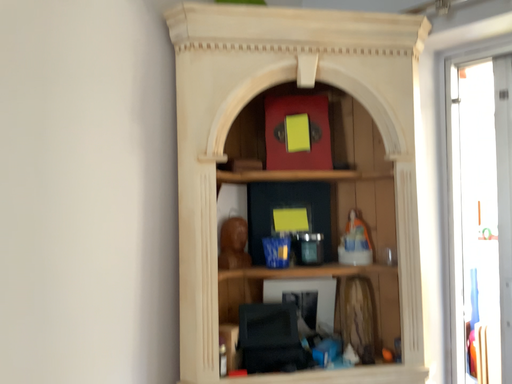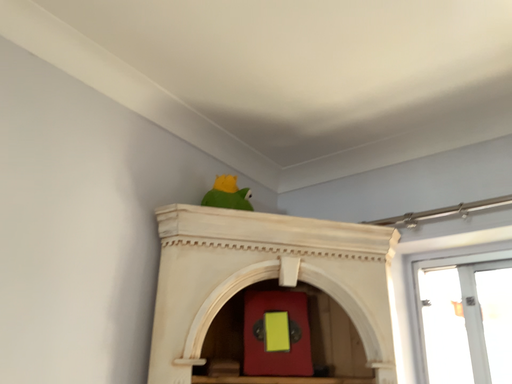
Question: Which way did the camera rotate in the video?

Choices:
 (A) rotated left
 (B) rotated right

Answer: (B)